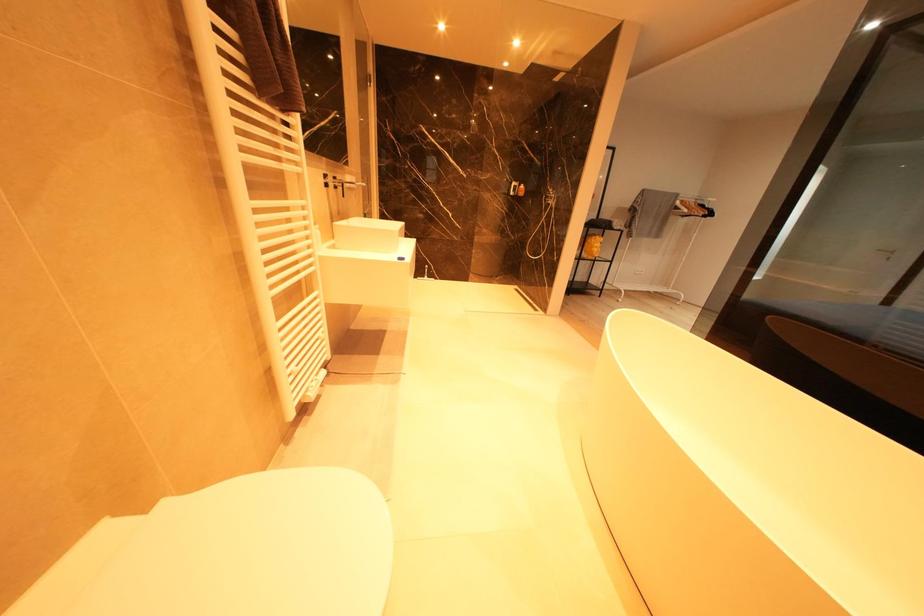
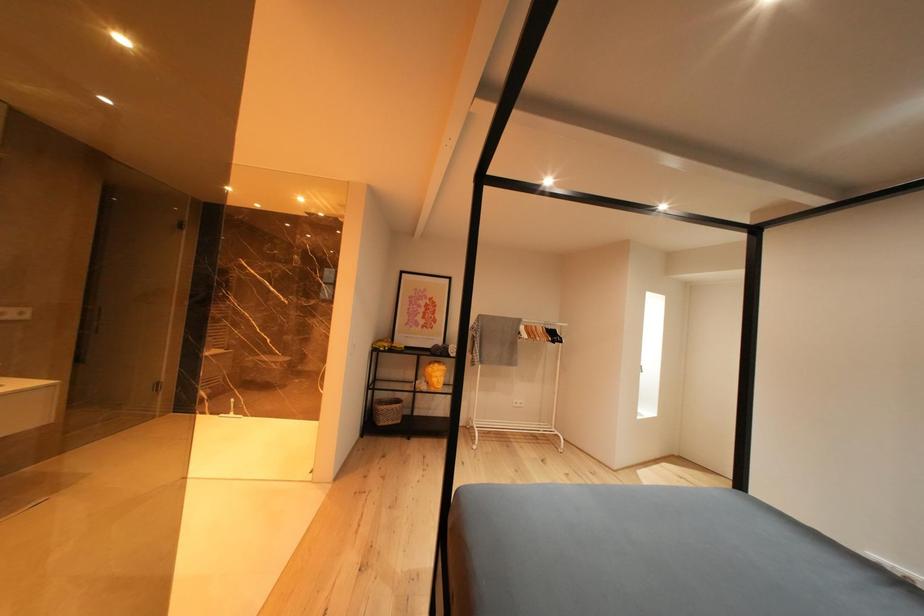
Question: Which direction would the cameraman need to move to produce the second image? Reply with the corresponding letter.

Choices:
 (A) Left
 (B) Right
 (C) Forward
 (D) Backward

Answer: (B)